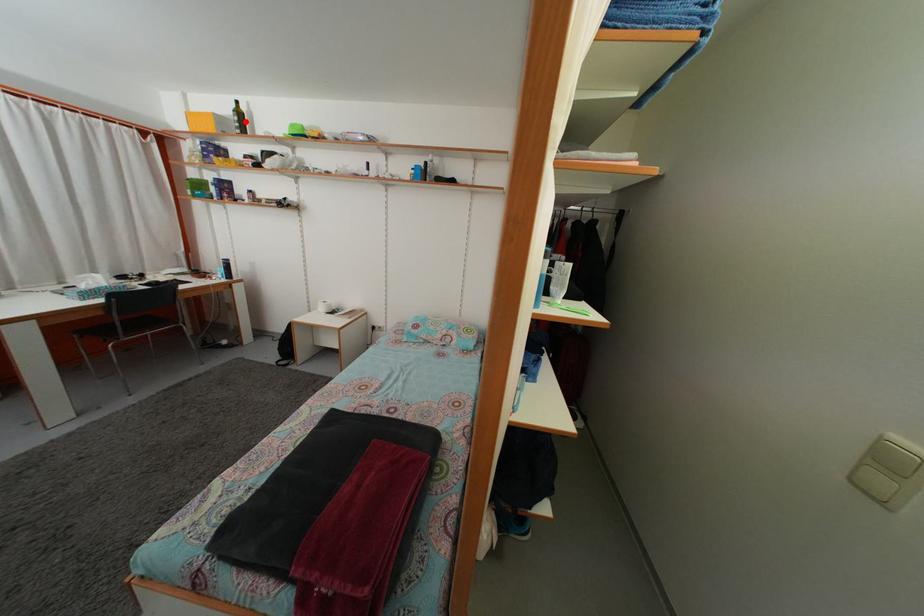
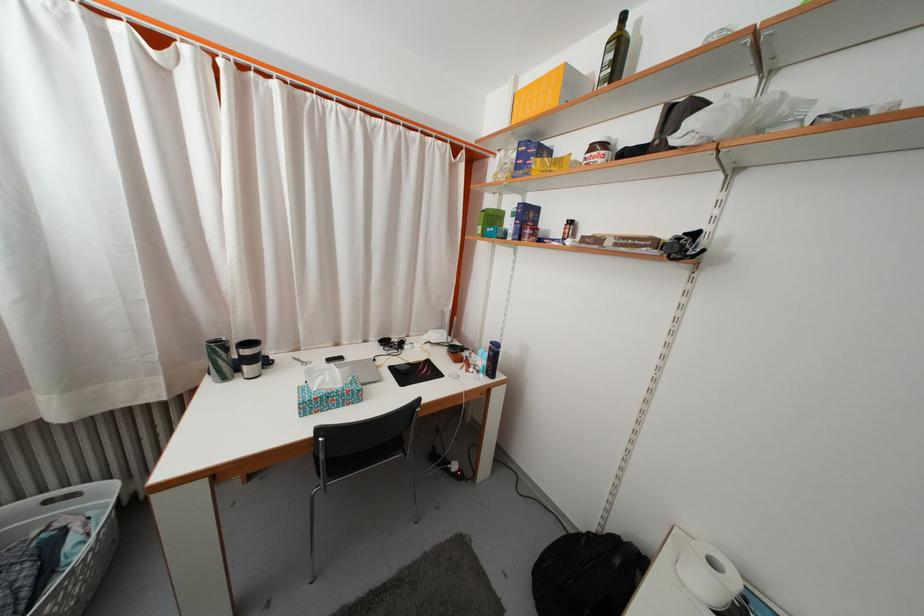
In the second image, find the point that corresponds to the highlighted location in the first image.

(625, 54)